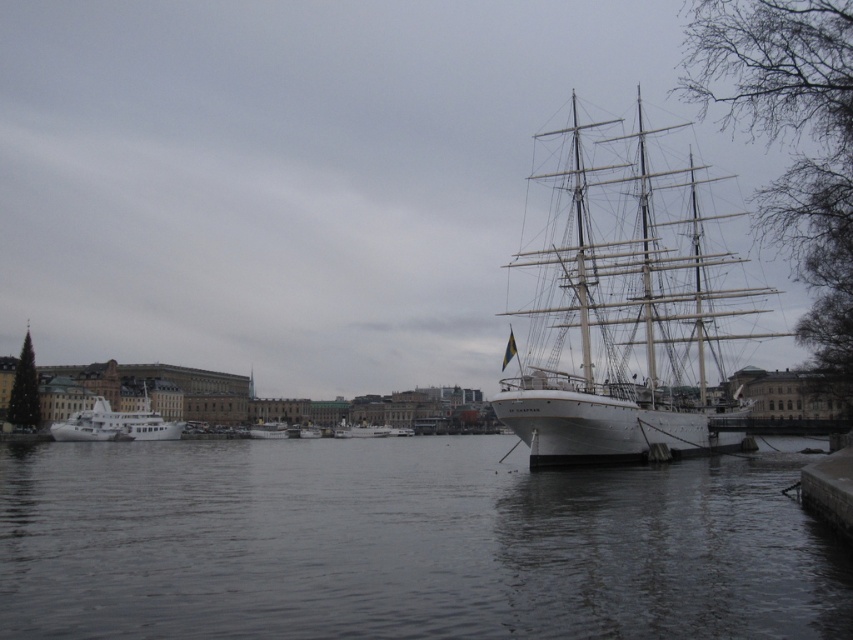
Who is more forward, [589,545] or [614,324]?

Point [589,545]

The image size is (853, 640). Describe the element at coordinates (404, 545) in the screenshot. I see `dark gray water at center` at that location.

Identify the location of dark gray water at center. (404, 545).

Between point (175, 428) and point (306, 426), which one is positioned behind?

The point (306, 426) is behind.

Does point (88, 429) come in front of point (303, 436)?

Yes, point (88, 429) is closer to viewer.

The height and width of the screenshot is (640, 853). Find the location of `white glossy yacht at left`. white glossy yacht at left is located at coordinates (114, 426).

Consider the image. Can you confirm if white wooden sailboat at right is positioned below white glossy boat at center?

No, white wooden sailboat at right is not below white glossy boat at center.

Consider the image. Which of these two, white wooden sailboat at right or white glossy boat at center, stands shorter?

white glossy boat at center is shorter.

What do you see at coordinates (619, 316) in the screenshot? I see `white wooden sailboat at right` at bounding box center [619, 316].

I want to click on white wooden sailboat at right, so click(619, 316).